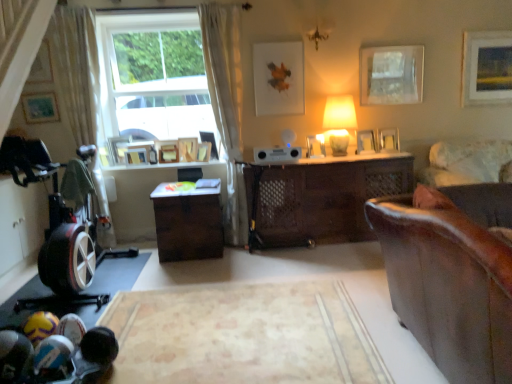
Identify the location of free space in front of wooden picture frame at upper left, which appears as the 11th picture frame when viewed from the right. The height and width of the screenshot is (384, 512). (132, 167).